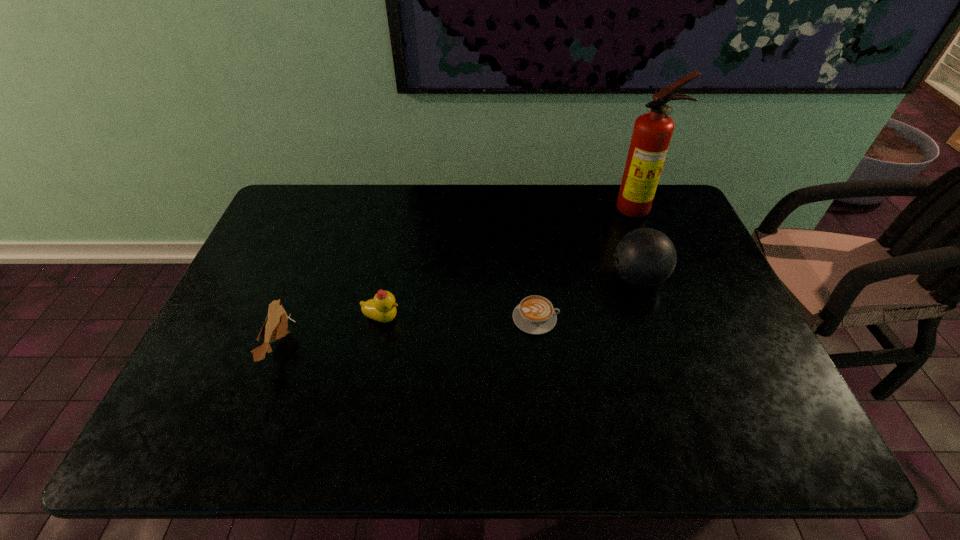
What are the coordinates of `vacant point located between the third object from right to left and the leftmost object` in the screenshot? It's located at (407, 332).

This screenshot has width=960, height=540. In order to click on free space between the third object from left to right and the bird in this screenshot , I will do `click(407, 332)`.

Where is `vacant region between the shortest object and the second tallest object`? The image size is (960, 540). vacant region between the shortest object and the second tallest object is located at coordinates (587, 298).

Where is `empty location between the cappuccino and the farthest object`? empty location between the cappuccino and the farthest object is located at coordinates (587, 264).

Choose which object is the nearest neighbor to the farthest object. Please provide its 2D coordinates. Your answer should be formatted as a tuple, i.e. [(x, y)], where the tuple contains the x and y coordinates of a point satisfying the conditions above.

[(645, 257)]

Identify which object is located as the nearest to the fourth nearest object. Please provide its 2D coordinates. Your answer should be formatted as a tuple, i.e. [(x, y)], where the tuple contains the x and y coordinates of a point satisfying the conditions above.

[(535, 315)]

Identify the location of free spot that satisfies the following two spatial constraints: 1. on the front-facing side of the farthest object; 2. on the side of the third object from left to right with the handle. This screenshot has height=540, width=960. (682, 318).

Where is `vacant space that satisfies the following two spatial constraints: 1. on the front-facing side of the farthest object; 2. on the grip area of the fourth shortest object`? The height and width of the screenshot is (540, 960). vacant space that satisfies the following two spatial constraints: 1. on the front-facing side of the farthest object; 2. on the grip area of the fourth shortest object is located at coordinates (665, 279).

Locate an element on the screen. This screenshot has width=960, height=540. vacant space that satisfies the following two spatial constraints: 1. on the front-facing side of the farthest object; 2. on the side of the shortest object with the handle is located at coordinates (682, 318).

Find the location of a particular element. This screenshot has width=960, height=540. vacant space that satisfies the following two spatial constraints: 1. on the front-facing side of the tallest object; 2. on the grip area of the second farthest object is located at coordinates (665, 279).